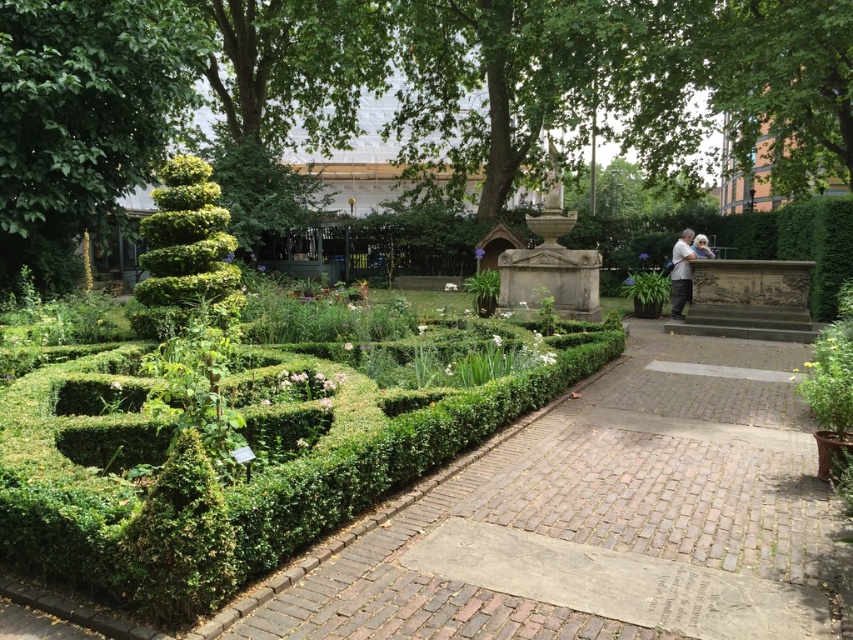
Based on the photo, you are a gardener who wants to plant a new flower bed between the green leafy tree at center and the green textured bush at lower left. Considering their heights, which one might cast more shadow over the flower bed during the afternoon?

The green leafy tree at center is much taller than the green textured bush at lower left, so it will cast a larger shadow over the flower bed during the afternoon.

You are standing at the entrance of the garden and want to reach the fountain. The green leafy bush at left is in your way. Can you walk around it by moving to the right side of the bush?

The green leafy bush at left is located at point (184,252), so yes, you can walk around it by moving to the right side of the green leafy bush at left to reach the fountain.

You are a gardener planning to water the green leafy tree at center and the green leafy bush at left. Which one should you water first if you want to start from the lowest point in the garden?

The green leafy bush at left should be watered first because it is positioned lower than the green leafy tree at center.